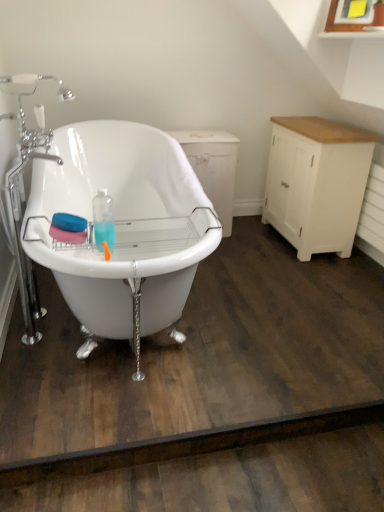
Question: Does white glossy bathtub at center contain white wood dresser at right?

Choices:
 (A) yes
 (B) no

Answer: (B)

Question: From a real-world perspective, is white glossy bathtub at center on white wood dresser at right?

Choices:
 (A) no
 (B) yes

Answer: (B)

Question: Is white glossy bathtub at center far away from white wood dresser at right?

Choices:
 (A) no
 (B) yes

Answer: (A)

Question: Is white glossy bathtub at center with white wood dresser at right?

Choices:
 (A) yes
 (B) no

Answer: (B)

Question: Is white glossy bathtub at center shorter than white wood dresser at right?

Choices:
 (A) yes
 (B) no

Answer: (B)

Question: In the image, is white wood dresser at right on the left side or the right side of white glossy bathtub at center?

Choices:
 (A) left
 (B) right

Answer: (B)

Question: Considering the positions of white wood dresser at right and white glossy bathtub at center in the image, is white wood dresser at right taller or shorter than white glossy bathtub at center?

Choices:
 (A) short
 (B) tall

Answer: (A)

Question: In terms of width, does white wood dresser at right look wider or thinner when compared to white glossy bathtub at center?

Choices:
 (A) wide
 (B) thin

Answer: (B)

Question: From the image's perspective, is white wood dresser at right above or below white glossy bathtub at center?

Choices:
 (A) below
 (B) above

Answer: (B)

Question: From a real-world perspective, relative to white wood dresser at right, is white painted wood cabinet at right vertically above or below?

Choices:
 (A) below
 (B) above

Answer: (B)

Question: Is white painted wood cabinet at right in front of or behind white wood dresser at right in the image?

Choices:
 (A) behind
 (B) front

Answer: (B)

Question: From the image's perspective, relative to white wood dresser at right, is white painted wood cabinet at right above or below?

Choices:
 (A) below
 (B) above

Answer: (A)

Question: Is white painted wood cabinet at right bigger or smaller than white wood dresser at right?

Choices:
 (A) small
 (B) big

Answer: (B)

Question: Choose the correct answer: Is white glossy bathtub at center inside white wood dresser at right or outside it?

Choices:
 (A) inside
 (B) outside

Answer: (B)

Question: In terms of height, does white glossy bathtub at center look taller or shorter compared to white wood dresser at right?

Choices:
 (A) short
 (B) tall

Answer: (B)